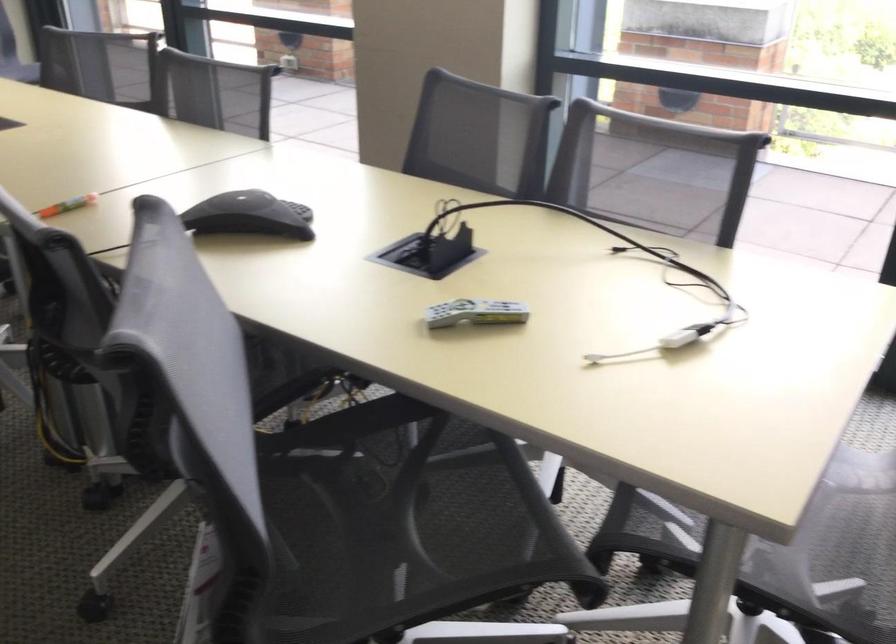
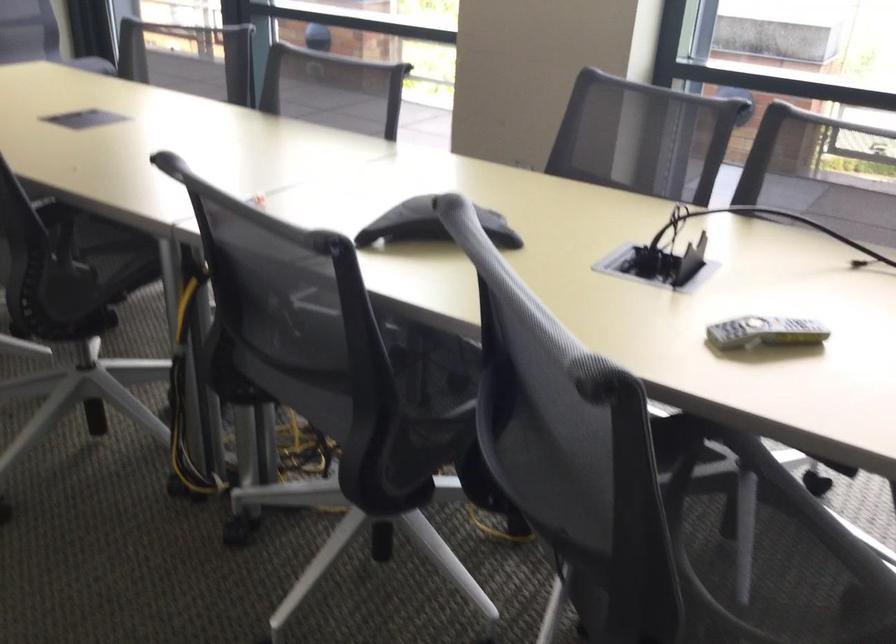
Find the pixel in the second image that matches [475,315] in the first image.

(764, 332)